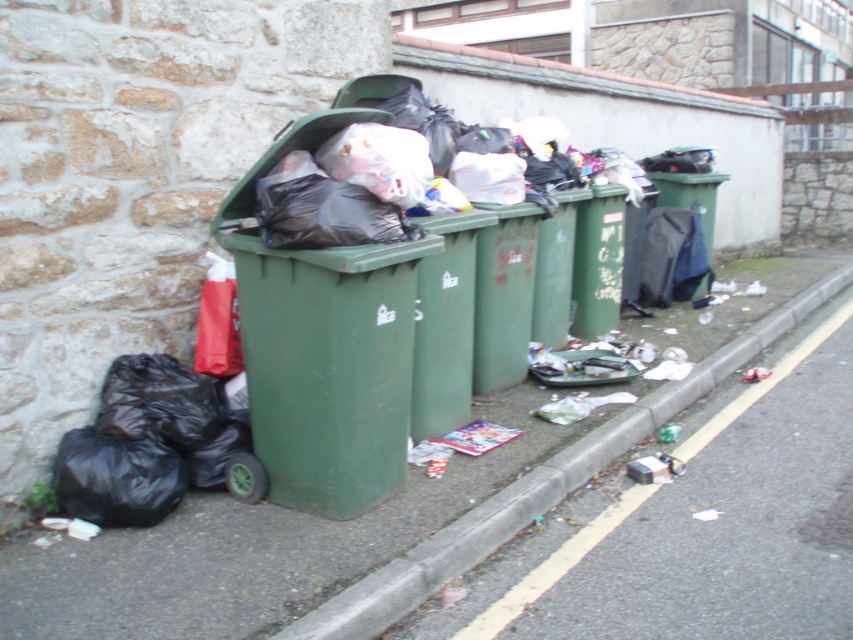
Question: Does green plastic pavement at lower left have a lesser width compared to green plastic bin at left?

Choices:
 (A) yes
 (B) no

Answer: (B)

Question: Which point is farther to the camera?

Choices:
 (A) green plastic bin at left
 (B) green plastic pavement at lower left

Answer: (A)

Question: Does green plastic pavement at lower left appear under green plastic bin at left?

Choices:
 (A) yes
 (B) no

Answer: (A)

Question: Considering the relative positions of green plastic pavement at lower left and green plastic bin at left in the image provided, where is green plastic pavement at lower left located with respect to green plastic bin at left?

Choices:
 (A) left
 (B) right

Answer: (B)

Question: Which of the following is the closest to the observer?

Choices:
 (A) green plastic bin at left
 (B) green plastic pavement at lower left

Answer: (B)